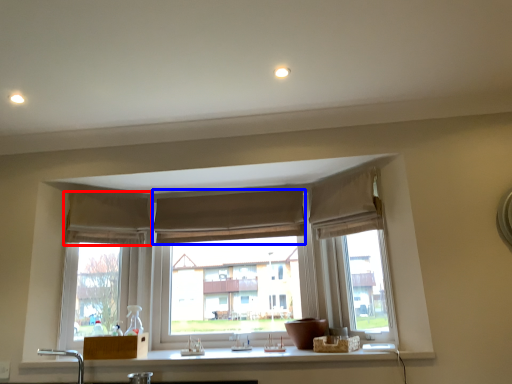
Question: Which of the following is the farthest to the observer, curtain (highlighted by a red box) or curtain (highlighted by a blue box)?

Choices:
 (A) curtain
 (B) curtain

Answer: (B)